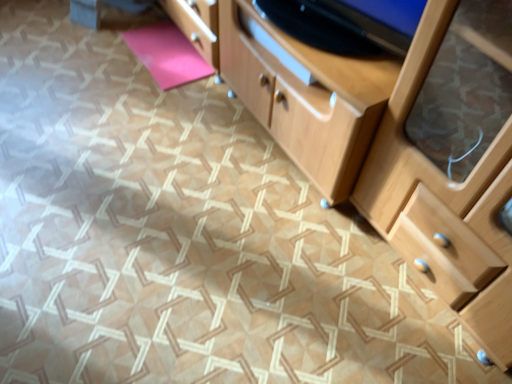
Question: Is pink matte yoga mat at upper left at the left side of light wood chest of drawers at center?

Choices:
 (A) no
 (B) yes

Answer: (B)

Question: Does pink matte yoga mat at upper left have a smaller size compared to light wood chest of drawers at center?

Choices:
 (A) yes
 (B) no

Answer: (A)

Question: Would you say light wood chest of drawers at center is part of pink matte yoga mat at upper left's contents?

Choices:
 (A) yes
 (B) no

Answer: (B)

Question: Is pink matte yoga mat at upper left at the right side of light wood chest of drawers at center?

Choices:
 (A) yes
 (B) no

Answer: (B)

Question: From the image's perspective, is pink matte yoga mat at upper left above light wood chest of drawers at center?

Choices:
 (A) yes
 (B) no

Answer: (A)

Question: Does pink matte yoga mat at upper left have a larger size compared to light wood chest of drawers at center?

Choices:
 (A) yes
 (B) no

Answer: (B)

Question: From the image's perspective, is light wood chest of drawers at center over pink matte yoga mat at upper left?

Choices:
 (A) no
 (B) yes

Answer: (A)

Question: Considering the relative sizes of light wood chest of drawers at center and pink matte yoga mat at upper left in the image provided, is light wood chest of drawers at center shorter than pink matte yoga mat at upper left?

Choices:
 (A) no
 (B) yes

Answer: (A)

Question: Is light wood chest of drawers at center not within pink matte yoga mat at upper left?

Choices:
 (A) yes
 (B) no

Answer: (A)

Question: Is light wood chest of drawers at center taller than pink matte yoga mat at upper left?

Choices:
 (A) yes
 (B) no

Answer: (A)

Question: Considering the relative sizes of light wood chest of drawers at center and pink matte yoga mat at upper left in the image provided, is light wood chest of drawers at center thinner than pink matte yoga mat at upper left?

Choices:
 (A) yes
 (B) no

Answer: (B)

Question: Is light wood chest of drawers at center next to pink matte yoga mat at upper left and touching it?

Choices:
 (A) yes
 (B) no

Answer: (B)

Question: From the image's perspective, relative to pink matte yoga mat at upper left, is light wood chest of drawers at center above or below?

Choices:
 (A) above
 (B) below

Answer: (B)